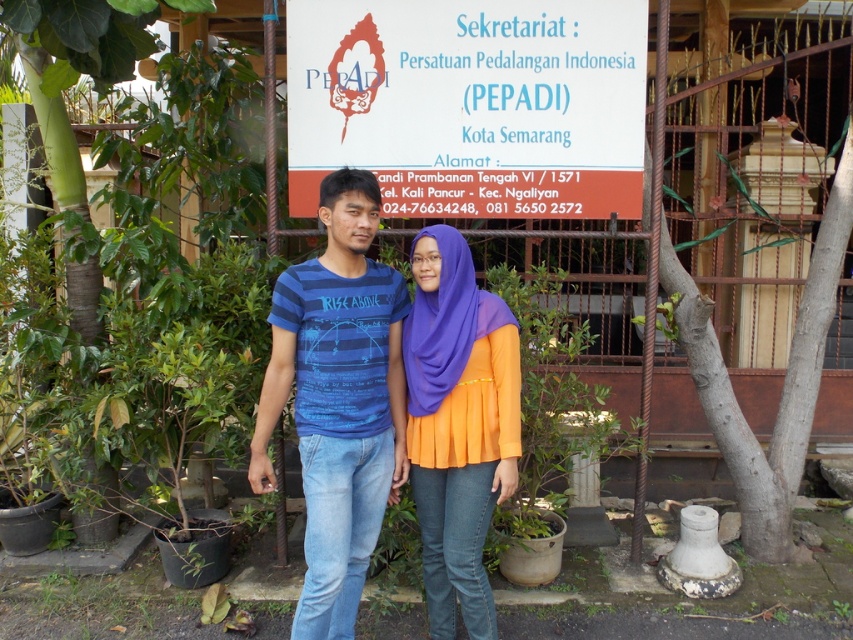
You are a photographer trying to capture both the white paper sign at upper center and the orange pleated blouse at center in a single frame. Based on their sizes in the image, which object would you need to focus on first to ensure both are in focus?

The white paper sign at upper center has a smaller size compared to the orange pleated blouse at center. To ensure both are in focus, you should focus on the orange pleated blouse at center first since it is larger and might be closer to the camera, allowing the smaller sign to fall within the depth of field.

You are a photographer trying to capture a clear shot of the white paper sign at upper center and the orange pleated blouse at center. Based on their positions, which object is wider?

The white paper sign at upper center is wider than the orange pleated blouse at center according to the description.